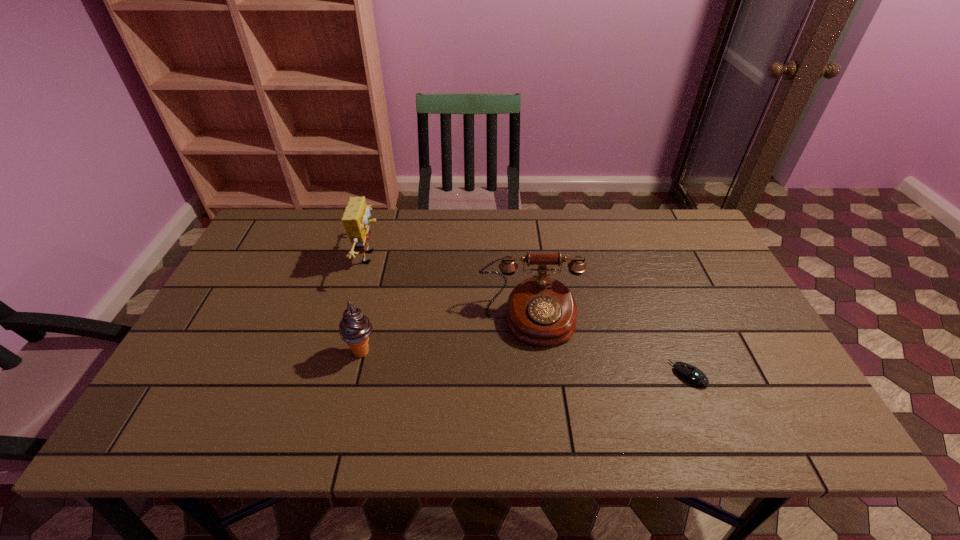
Identify the location of empty space between the computer mouse and the icecream. The image size is (960, 540). (525, 363).

At what (x,y) coordinates should I click in order to perform the action: click on free spot between the computer mouse and the telephone. Please return your answer as a coordinate pair (x, y). This screenshot has height=540, width=960. Looking at the image, I should click on (610, 347).

At what (x,y) coordinates should I click in order to perform the action: click on unoccupied position between the computer mouse and the icecream. Please return your answer as a coordinate pair (x, y). Looking at the image, I should click on (525, 363).

Image resolution: width=960 pixels, height=540 pixels. What are the coordinates of `vacant region between the third object from left to right and the farthest object` in the screenshot? It's located at (450, 288).

You are a GUI agent. You are given a task and a screenshot of the screen. Output one action in this format:
    pyautogui.click(x=<x>, y=<y>)
    Task: Click on the unoccupied position between the farthest object and the third object from left to right
    This screenshot has width=960, height=540.
    Given the screenshot: What is the action you would take?
    pyautogui.click(x=450, y=288)

Locate which object is the third closest to the third object from left to right. Please provide its 2D coordinates. Your answer should be formatted as a tuple, i.e. [(x, y)], where the tuple contains the x and y coordinates of a point satisfying the conditions above.

[(355, 219)]

You are a GUI agent. You are given a task and a screenshot of the screen. Output one action in this format:
    pyautogui.click(x=<x>, y=<y>)
    Task: Click on the object that is the closest to the icecream
    This screenshot has width=960, height=540.
    Given the screenshot: What is the action you would take?
    pyautogui.click(x=355, y=219)

Locate an element on the screen. This screenshot has width=960, height=540. free space that satisfies the following two spatial constraints: 1. on the face of the farthest object; 2. on the back side of the icecream is located at coordinates (344, 352).

Where is `vacant space that satisfies the following two spatial constraints: 1. on the face of the farthest object; 2. on the right side of the icecream`? vacant space that satisfies the following two spatial constraints: 1. on the face of the farthest object; 2. on the right side of the icecream is located at coordinates (344, 352).

You are a GUI agent. You are given a task and a screenshot of the screen. Output one action in this format:
    pyautogui.click(x=<x>, y=<y>)
    Task: Click on the free space that satisfies the following two spatial constraints: 1. on the face of the farthest object; 2. on the back side of the shortest object
    The image size is (960, 540).
    Given the screenshot: What is the action you would take?
    pyautogui.click(x=338, y=375)